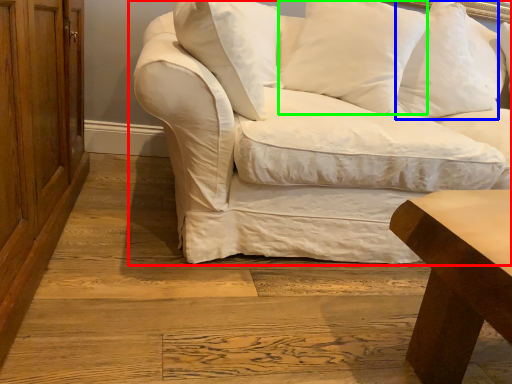
Question: Which is nearer to the studio couch (highlighted by a red box)? pillow (highlighted by a blue box) or pillow (highlighted by a green box).

Choices:
 (A) pillow
 (B) pillow

Answer: (B)